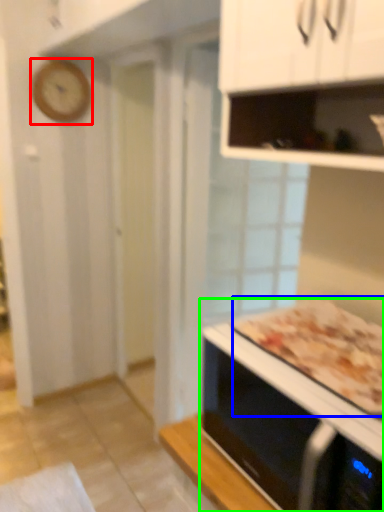
Question: Estimate the real-world distances between objects in this image. Which object is farther from clock (highlighted by a red box), pizza (highlighted by a blue box) or microwave oven (highlighted by a green box)?

Choices:
 (A) pizza
 (B) microwave oven

Answer: (B)